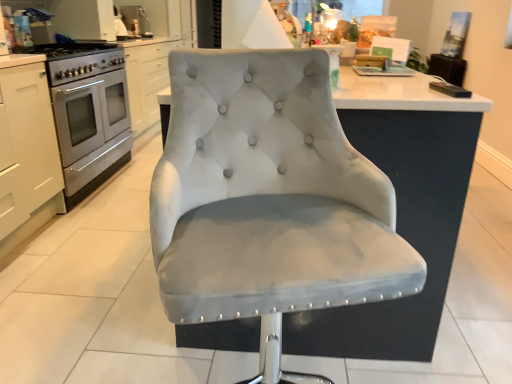
Question: Are satin silver oven at left and satin silver gas stove at left far apart?

Choices:
 (A) yes
 (B) no

Answer: (B)

Question: Is satin silver oven at left behind satin silver gas stove at left?

Choices:
 (A) no
 (B) yes

Answer: (B)

Question: Is satin silver oven at left shorter than satin silver gas stove at left?

Choices:
 (A) no
 (B) yes

Answer: (A)

Question: Considering the relative positions of satin silver oven at left and satin silver gas stove at left in the image provided, is satin silver oven at left in front of satin silver gas stove at left?

Choices:
 (A) yes
 (B) no

Answer: (B)

Question: Is satin silver oven at left looking in the opposite direction of satin silver gas stove at left?

Choices:
 (A) yes
 (B) no

Answer: (B)

Question: From the image's perspective, is satin silver oven at left under satin silver gas stove at left?

Choices:
 (A) no
 (B) yes

Answer: (B)

Question: From a real-world perspective, is white matte cabinet at left positioned over suede-like gray chair at center based on gravity?

Choices:
 (A) no
 (B) yes

Answer: (A)

Question: Is suede-like gray chair at center located within white matte cabinet at left?

Choices:
 (A) yes
 (B) no

Answer: (B)

Question: Is white matte cabinet at left touching suede-like gray chair at center?

Choices:
 (A) yes
 (B) no

Answer: (B)

Question: Is suede-like gray chair at center at the back of white matte cabinet at left?

Choices:
 (A) yes
 (B) no

Answer: (B)

Question: Is white matte cabinet at left oriented towards suede-like gray chair at center?

Choices:
 (A) yes
 (B) no

Answer: (B)

Question: Considering the relative sizes of white matte cabinet at left and suede-like gray chair at center in the image provided, is white matte cabinet at left shorter than suede-like gray chair at center?

Choices:
 (A) no
 (B) yes

Answer: (B)

Question: Does satin silver gas stove at left lie behind white matte cabinet at left?

Choices:
 (A) no
 (B) yes

Answer: (B)